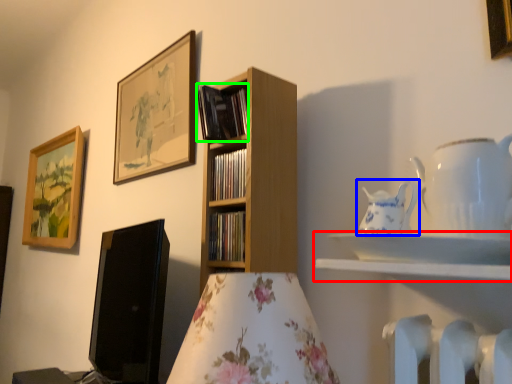
Question: Which object is positioned farthest from shelf (highlighted by a red box)? Select from tableware (highlighted by a blue box) and book (highlighted by a green box).

Choices:
 (A) tableware
 (B) book

Answer: (B)